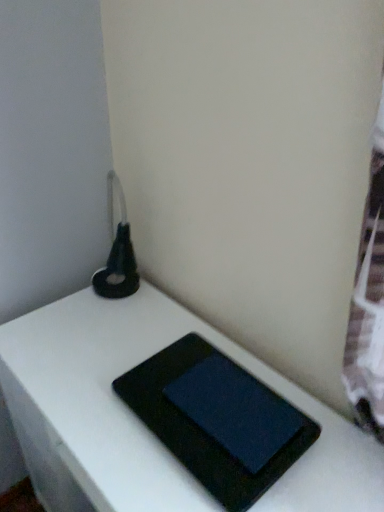
Question: From a real-world perspective, is black matte tablet at center, placed as the 1th tablet computer when sorted from bottom to top, positioned over matte black tablet at center, acting as the 2th tablet computer starting from the bottom, based on gravity?

Choices:
 (A) no
 (B) yes

Answer: (A)

Question: Is matte black tablet at center, which ranks as the 1th tablet computer in top-to-bottom order, at the back of black matte tablet at center, placed as the 1th tablet computer when sorted from bottom to top?

Choices:
 (A) yes
 (B) no

Answer: (B)

Question: Would you consider black matte tablet at center, placed as the 1th tablet computer when sorted from bottom to top, to be distant from matte black tablet at center, acting as the 2th tablet computer starting from the bottom?

Choices:
 (A) no
 (B) yes

Answer: (A)

Question: Can you confirm if black matte tablet at center, placed as the 1th tablet computer when sorted from bottom to top, is wider than matte black tablet at center, acting as the 2th tablet computer starting from the bottom?

Choices:
 (A) yes
 (B) no

Answer: (A)

Question: Does black matte tablet at center, placed as the 1th tablet computer when sorted from bottom to top, touch matte black tablet at center, acting as the 2th tablet computer starting from the bottom?

Choices:
 (A) yes
 (B) no

Answer: (A)

Question: Considering the relative positions of black matte tablet at center, the 2th tablet computer in the top-to-bottom sequence, and matte black tablet at center, which ranks as the 1th tablet computer in top-to-bottom order, in the image provided, is black matte tablet at center, the 2th tablet computer in the top-to-bottom sequence, to the left of matte black tablet at center, which ranks as the 1th tablet computer in top-to-bottom order, from the viewer's perspective?

Choices:
 (A) yes
 (B) no

Answer: (A)

Question: From the image's perspective, does black matte book at center appear lower than black matte tablet at center, placed as the 1th tablet computer when sorted from bottom to top?

Choices:
 (A) yes
 (B) no

Answer: (A)

Question: Considering the relative positions of black matte book at center and black matte tablet at center, placed as the 1th tablet computer when sorted from bottom to top, in the image provided, is black matte book at center behind black matte tablet at center, placed as the 1th tablet computer when sorted from bottom to top,?

Choices:
 (A) yes
 (B) no

Answer: (B)

Question: Is black matte book at center to the left of black matte tablet at center, the 2th tablet computer in the top-to-bottom sequence, from the viewer's perspective?

Choices:
 (A) no
 (B) yes

Answer: (B)

Question: Can you confirm if black matte book at center is wider than black matte tablet at center, placed as the 1th tablet computer when sorted from bottom to top?

Choices:
 (A) no
 (B) yes

Answer: (B)

Question: Does black matte book at center have a lesser height compared to black matte tablet at center, the 2th tablet computer in the top-to-bottom sequence?

Choices:
 (A) no
 (B) yes

Answer: (A)

Question: Is black matte book at center turned away from black matte tablet at center, the 2th tablet computer in the top-to-bottom sequence?

Choices:
 (A) yes
 (B) no

Answer: (B)

Question: From the image's perspective, is matte black tablet at center, acting as the 2th tablet computer starting from the bottom, over black matte book at center?

Choices:
 (A) no
 (B) yes

Answer: (B)